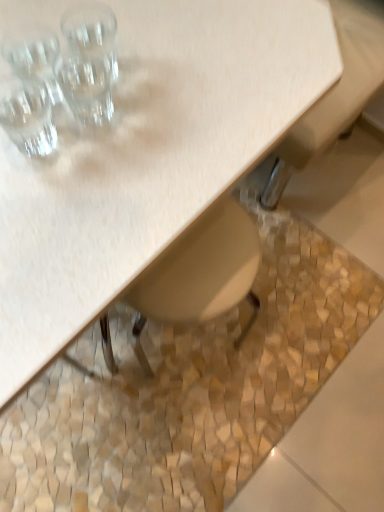
Locate an element on the screen. free space in front of clear glass shot glass at upper left, which appears as the 1th shot glass when ordered from the bottom is located at coordinates (50, 229).